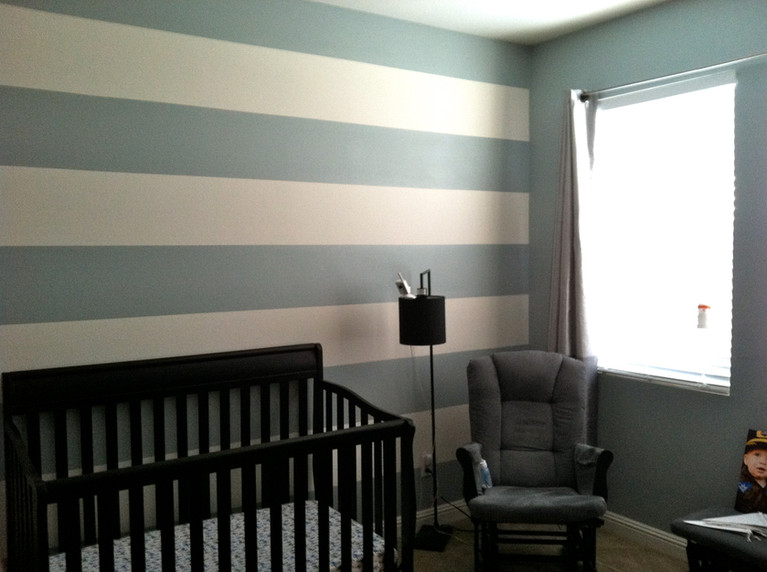
Where is `gray green wall`? This screenshot has height=572, width=767. gray green wall is located at coordinates (492, 58), (463, 153), (496, 266), (456, 366), (741, 344), (636, 67), (542, 237).